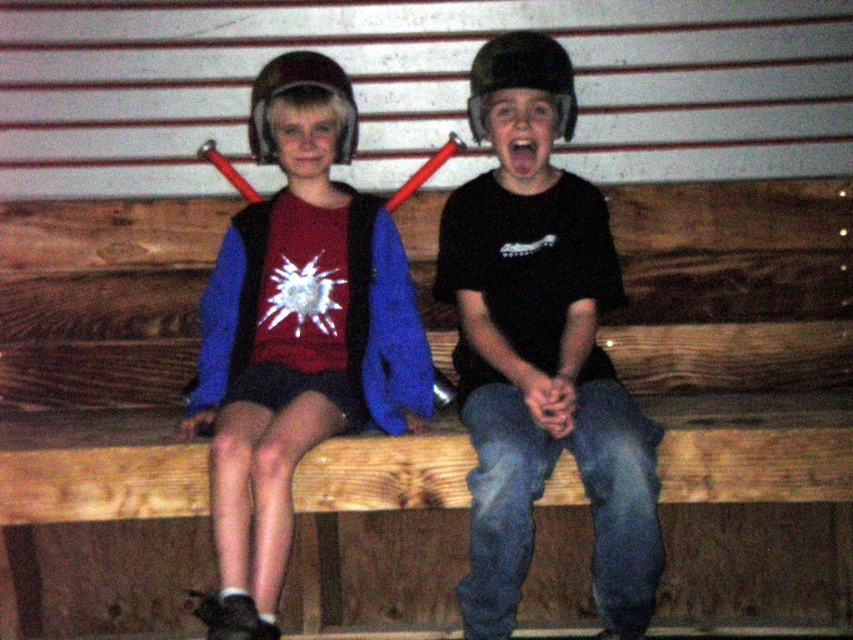
Who is lower down, matte black helmet at left or matte plastic helmet at upper center?

matte black helmet at left is below.

Who is more distant from viewer, [225,248] or [351,141]?

Point [351,141]

Locate an element on the screen. The height and width of the screenshot is (640, 853). matte black helmet at left is located at coordinates (296, 333).

Which is more to the left, black matte helmet at center or matte black helmet at center?

matte black helmet at center

Between point (509, 490) and point (477, 60), which one is positioned behind?

The point (477, 60) is more distant.

What are the coordinates of `black matte helmet at center` in the screenshot? It's located at (540, 348).

Does matte black helmet at center lie in front of matte plastic helmet at upper center?

Yes, it is.

What do you see at coordinates (521, 76) in the screenshot? I see `matte black helmet at center` at bounding box center [521, 76].

The height and width of the screenshot is (640, 853). What are the coordinates of `matte black helmet at center` in the screenshot? It's located at (521, 76).